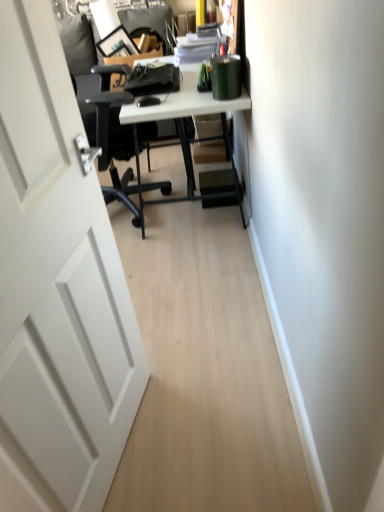
This screenshot has width=384, height=512. I want to click on white matte door at left, so click(57, 288).

Describe the element at coordinates (57, 288) in the screenshot. The height and width of the screenshot is (512, 384). I see `white matte door at left` at that location.

The image size is (384, 512). Describe the element at coordinates (182, 125) in the screenshot. I see `white glossy desk at center` at that location.

Where is `white glossy desk at center`? The height and width of the screenshot is (512, 384). white glossy desk at center is located at coordinates (182, 125).

What are the coordinates of `white matte door at left` in the screenshot? It's located at (57, 288).

Which is more to the left, white matte door at left or white glossy desk at center?

Positioned to the left is white matte door at left.

Which is behind, white matte door at left or white glossy desk at center?

Positioned behind is white glossy desk at center.

Which point is more distant from viewer, (11, 313) or (129, 105)?

The point (129, 105) is more distant.

From the image's perspective, which object appears higher, white matte door at left or white glossy desk at center?

white glossy desk at center.

From a real-world perspective, between white matte door at left and white glossy desk at center, who is vertically lower?

white glossy desk at center is physically lower.

Based on the photo, does white matte door at left have a lesser width compared to white glossy desk at center?

Yes, white matte door at left is thinner than white glossy desk at center.

Does white matte door at left have a greater height compared to white glossy desk at center?

Yes.

Considering the relative sizes of white matte door at left and white glossy desk at center in the image provided, is white matte door at left smaller than white glossy desk at center?

Yes, white matte door at left is smaller than white glossy desk at center.

In the scene shown: Is white glossy desk at center a part of white matte door at left?

No, white glossy desk at center is located outside of white matte door at left.

Is white matte door at left not near white glossy desk at center?

Yes.

Is white matte door at left oriented towards white glossy desk at center?

No, white matte door at left does not turn towards white glossy desk at center.

Can you tell me how much white matte door at left and white glossy desk at center differ in facing direction?

There is a 166-degree angle between the facing directions of white matte door at left and white glossy desk at center.

At what (x,y) coordinates should I click in order to perform the action: click on desk that appears below the white matte door at left (from a real-world perspective). Please return your answer as a coordinate pair (x, y). This screenshot has height=512, width=384. Looking at the image, I should click on (182, 125).

Which is more to the left, white glossy desk at center or white matte door at left?

From the viewer's perspective, white matte door at left appears more on the left side.

Is white glossy desk at center in front of white matte door at left?

No, the depth of white glossy desk at center is greater than that of white matte door at left.

Considering the positions of point (238, 109) and point (90, 172), is point (238, 109) closer or farther from the camera than point (90, 172)?

Point (238, 109) appears to be farther away from the viewer than point (90, 172).

From the image's perspective, is white glossy desk at center on top of white matte door at left?

Correct, white glossy desk at center appears higher than white matte door at left in the image.

From a real-world perspective, who is located lower, white glossy desk at center or white matte door at left?

In real-world perspective, white glossy desk at center is lower.

In terms of width, does white glossy desk at center look wider or thinner when compared to white matte door at left?

white glossy desk at center is wider than white matte door at left.

From their relative heights in the image, would you say white glossy desk at center is taller or shorter than white matte door at left?

Clearly, white glossy desk at center is shorter compared to white matte door at left.

Based on the photo, which of these two, white glossy desk at center or white matte door at left, is smaller?

white matte door at left is smaller.

Is white matte door at left completely or partially inside white glossy desk at center?

No, white matte door at left is not surrounded by white glossy desk at center.

Is white glossy desk at center placed right next to white matte door at left?

No, white glossy desk at center is not in contact with white matte door at left.

In the scene shown: Is white glossy desk at center turned away from white matte door at left?

white glossy desk at center does not have its back to white matte door at left.

The height and width of the screenshot is (512, 384). I want to click on door above the white glossy desk at center (from a real-world perspective), so click(57, 288).

Locate an element on the screen. This screenshot has height=512, width=384. door below the white glossy desk at center (from the image's perspective) is located at coordinates (57, 288).

Locate an element on the screen. The width and height of the screenshot is (384, 512). desk below the white matte door at left (from a real-world perspective) is located at coordinates (182, 125).